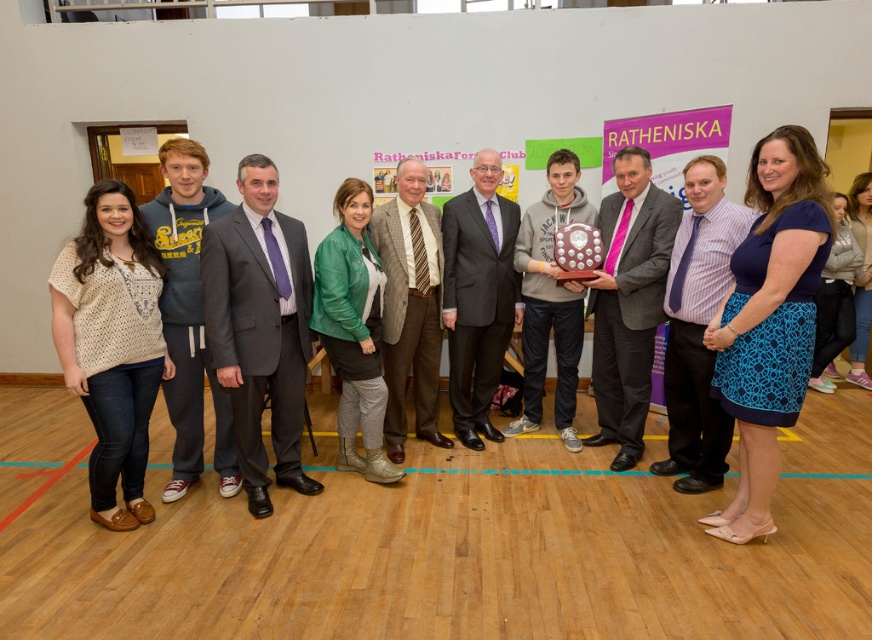
Measure the distance between matte silver trophy at center and brown textured blazer at center.

They are 39.22 inches apart.

Does point (620, 269) come farther from viewer compared to point (439, 257)?

No, (620, 269) is in front of (439, 257).

You are a GUI agent. You are given a task and a screenshot of the screen. Output one action in this format:
    pyautogui.click(x=<x>, y=<y>)
    Task: Click on the matte silver trophy at center
    The height and width of the screenshot is (640, 872).
    Given the screenshot: What is the action you would take?
    pyautogui.click(x=628, y=300)

Based on the photo, between dark gray suit at center and brown textured blazer at center, which one appears on the left side from the viewer's perspective?

Positioned to the left is brown textured blazer at center.

Can you confirm if dark gray suit at center is bigger than brown textured blazer at center?

Correct, dark gray suit at center is larger in size than brown textured blazer at center.

Between point (509, 227) and point (426, 420), which one is positioned behind?

Positioned behind is point (426, 420).

This screenshot has width=872, height=640. I want to click on dark gray suit at center, so click(x=478, y=296).

Does point (249, 230) come closer to viewer compared to point (417, 301)?

Yes.

Between matte gray suit at center and brown textured blazer at center, which one has more height?

matte gray suit at center

Is point (249, 305) closer to camera compared to point (399, 172)?

That is True.

Find the location of a particular element. The height and width of the screenshot is (640, 872). matte gray suit at center is located at coordinates (x=260, y=326).